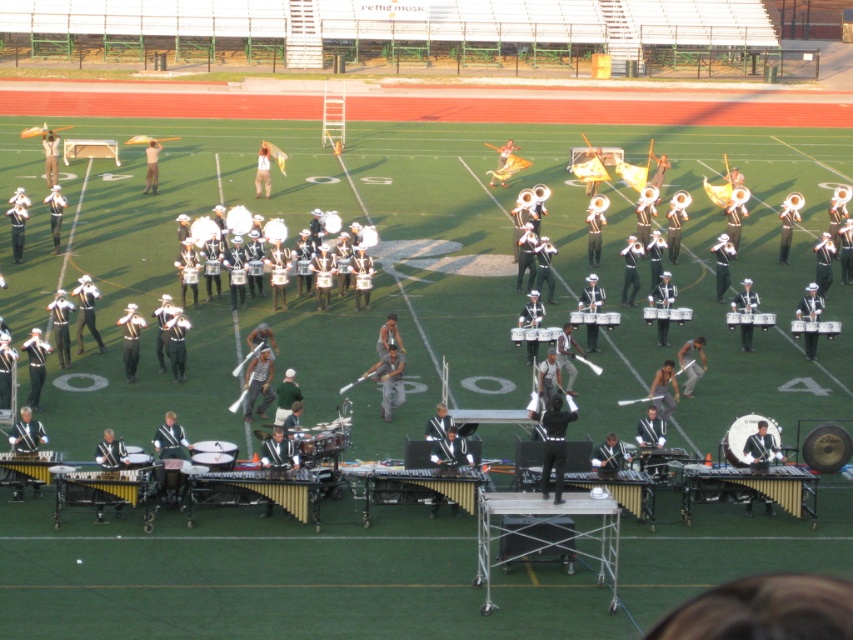
You are a band director observing the marching band setup. You need to adjust the positioning of the matte black drum at center and the metallic silver drum at center. Which drum is located lower in the setup?

The matte black drum at center is positioned under the metallic silver drum at center, so it is located lower in the setup.

You are a photographer standing at the edge of the football field where the marching band is performing. You want to take a photo that includes both the percussion section and the drumline. The percussion section is at point (727, 451) and the drumline is at point (805, 330). Which of these points is closer to you so that you can focus on it first?

Point (727, 451) is closer to the camera than point (805, 330), so you can focus on it first.

You are a band director observing the marching band setup. You notice the matte black drum at center and the metallic silver drum at center. Which drum is positioned higher in elevation?

The matte black drum at center is taller than the metallic silver drum at center, so it is positioned higher in elevation.